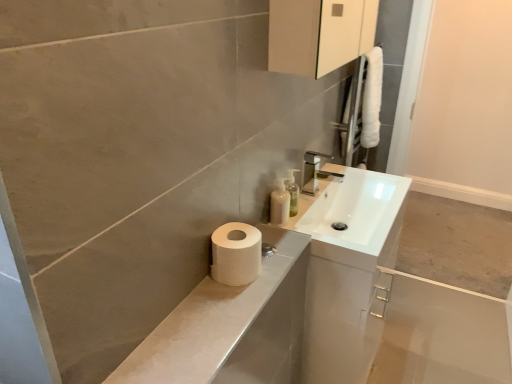
Identify the location of free spot above white matte toilet paper at lower left (from a real-world perspective). (219, 304).